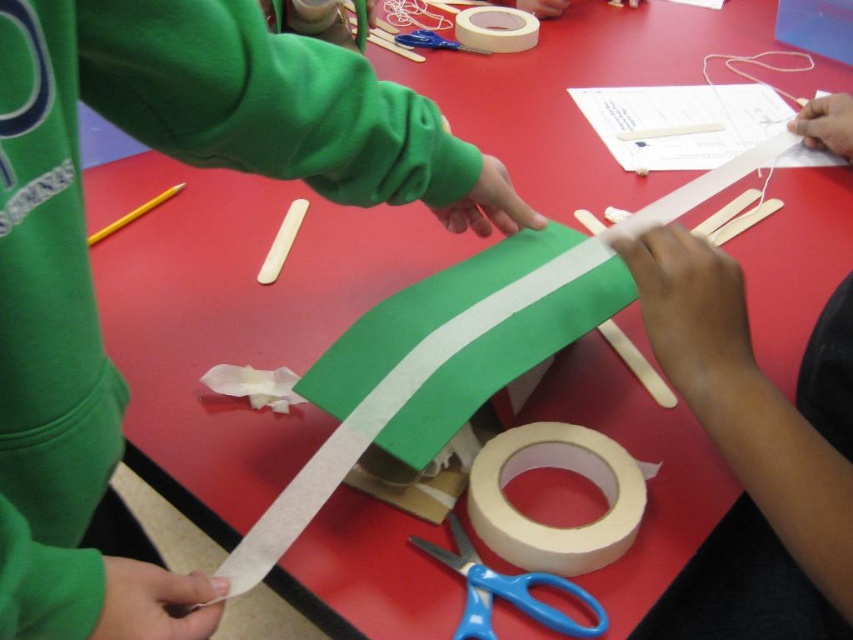
Question: Which object appears closest to the camera in this image?

Choices:
 (A) white matte tape at upper center
 (B) blue plastic scissors at lower center
 (C) matte white tape at center

Answer: (B)

Question: Considering the relative positions of matte white tape at center and blue plastic scissors at lower center in the image provided, where is matte white tape at center located with respect to blue plastic scissors at lower center?

Choices:
 (A) below
 (B) above

Answer: (B)

Question: Does matte white tape at center appear under white matte tape at upper center?

Choices:
 (A) yes
 (B) no

Answer: (A)

Question: Which object is positioned farthest from the matte white tape at center?

Choices:
 (A) white matte tape at upper center
 (B) blue plastic scissors at lower center

Answer: (A)

Question: Does matte white tape at center appear over white matte tape at upper center?

Choices:
 (A) no
 (B) yes

Answer: (A)

Question: Which point is closer to the camera?

Choices:
 (A) (595, 461)
 (B) (505, 36)
 (C) (500, 584)

Answer: (C)